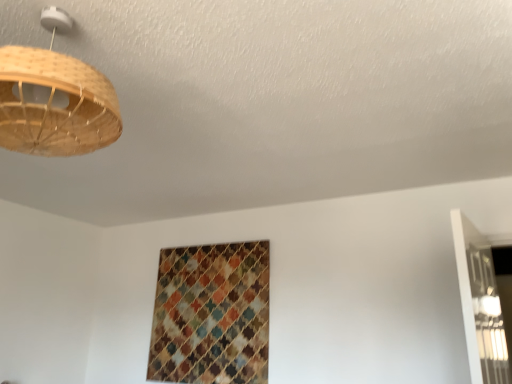
Question: Is natural wood lampshade at upper left further to camera compared to textured woven pattern at center?

Choices:
 (A) yes
 (B) no

Answer: (B)

Question: Is natural wood lampshade at upper left facing towards textured woven pattern at center?

Choices:
 (A) no
 (B) yes

Answer: (B)

Question: Is natural wood lampshade at upper left wider than textured woven pattern at center?

Choices:
 (A) no
 (B) yes

Answer: (B)

Question: Is natural wood lampshade at upper left located outside textured woven pattern at center?

Choices:
 (A) yes
 (B) no

Answer: (A)

Question: Considering the relative sizes of natural wood lampshade at upper left and textured woven pattern at center in the image provided, is natural wood lampshade at upper left smaller than textured woven pattern at center?

Choices:
 (A) yes
 (B) no

Answer: (B)

Question: Considering the relative sizes of natural wood lampshade at upper left and textured woven pattern at center in the image provided, is natural wood lampshade at upper left taller than textured woven pattern at center?

Choices:
 (A) no
 (B) yes

Answer: (A)

Question: Is textured woven pattern at center smaller than natural wood lampshade at upper left?

Choices:
 (A) yes
 (B) no

Answer: (A)

Question: Can you confirm if textured woven pattern at center is positioned to the right of natural wood lampshade at upper left?

Choices:
 (A) yes
 (B) no

Answer: (A)

Question: From the image's perspective, is textured woven pattern at center located above natural wood lampshade at upper left?

Choices:
 (A) no
 (B) yes

Answer: (A)

Question: From a real-world perspective, is textured woven pattern at center on top of natural wood lampshade at upper left?

Choices:
 (A) no
 (B) yes

Answer: (A)

Question: Is textured woven pattern at center further to the viewer compared to natural wood lampshade at upper left?

Choices:
 (A) no
 (B) yes

Answer: (B)

Question: Are textured woven pattern at center and natural wood lampshade at upper left located far from each other?

Choices:
 (A) no
 (B) yes

Answer: (B)

Question: Visually, is natural wood lampshade at upper left positioned to the left or to the right of textured woven pattern at center?

Choices:
 (A) right
 (B) left

Answer: (B)